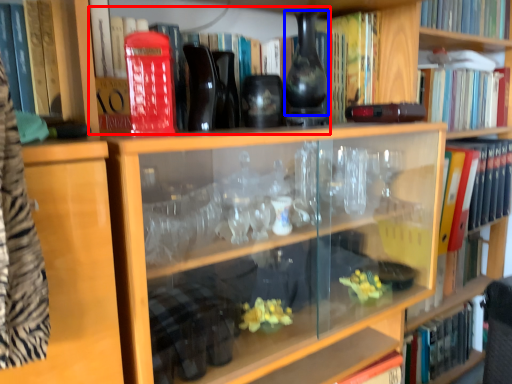
Question: Which object appears closest to the camera in this image, book (highlighted by a red box) or glass vase (highlighted by a blue box)?

Choices:
 (A) book
 (B) glass vase

Answer: (A)